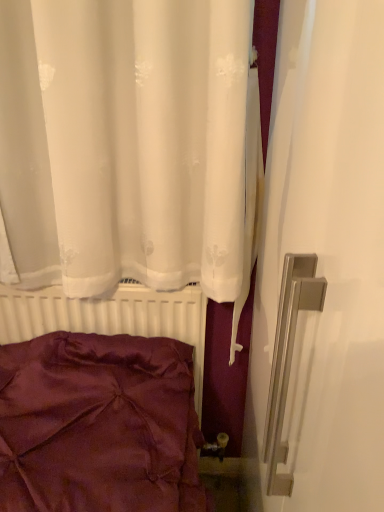
The width and height of the screenshot is (384, 512). What are the coordinates of `vacant area on top of white matte radiator at lower left (from a real-world perspective)` in the screenshot? It's located at (116, 281).